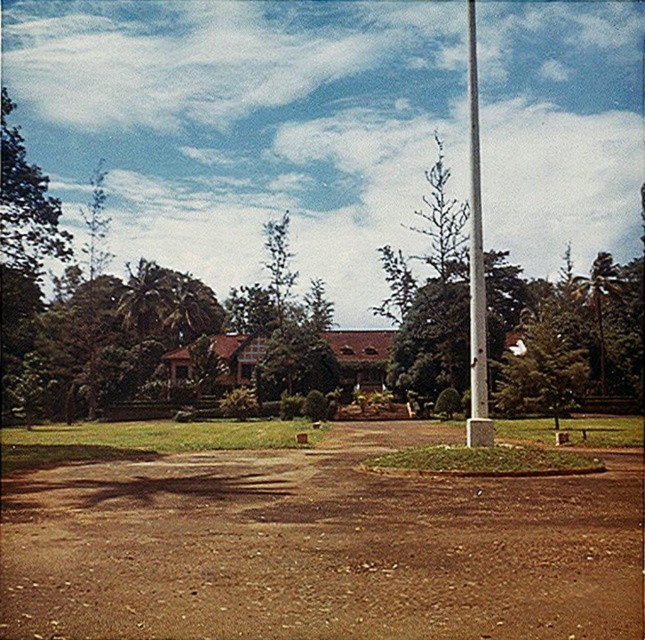
Is point (179, 460) positioned behind point (513, 404)?

That is False.

The height and width of the screenshot is (640, 645). In order to click on brown dirt field at center in this screenshot , I will do `click(319, 547)`.

Which of these two, green leafy tree at center or white smooth pole at center, stands taller?

Standing taller between the two is white smooth pole at center.

Is green leafy tree at center shorter than white smooth pole at center?

Yes, green leafy tree at center is shorter than white smooth pole at center.

Find the location of a particular element. Image resolution: width=645 pixels, height=640 pixels. green leafy tree at center is located at coordinates (235, 321).

Measure the distance between point (544, 330) and camera.

The distance of point (544, 330) from camera is 39.25 meters.

Is green textured tree at center thinner than white smooth pole at center?

Indeed, green textured tree at center has a lesser width compared to white smooth pole at center.

Measure the distance between point (x=533, y=355) and camera.

Point (x=533, y=355) is 36.53 meters away from camera.

You are a GUI agent. You are given a task and a screenshot of the screen. Output one action in this format:
    pyautogui.click(x=<x>, y=<y>)
    Task: Click on the green textured tree at center
    Image resolution: width=645 pixels, height=640 pixels.
    Given the screenshot: What is the action you would take?
    pyautogui.click(x=541, y=365)